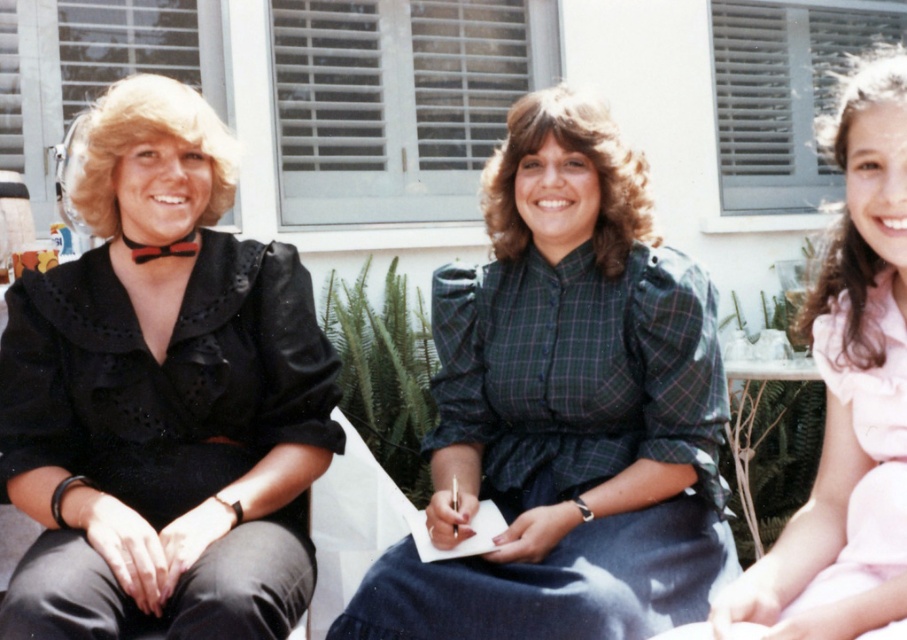
Question: Which object is the farthest from the black satin blouse at left?

Choices:
 (A) green plaid dress at center
 (B) pink satin dress at right

Answer: (B)

Question: Among these points, which one is farthest from the camera?

Choices:
 (A) (831, 291)
 (B) (498, 497)
 (C) (108, 618)

Answer: (B)

Question: Does green plaid dress at center have a larger size compared to pink satin dress at right?

Choices:
 (A) yes
 (B) no

Answer: (A)

Question: Is black satin blouse at left above pink satin dress at right?

Choices:
 (A) no
 (B) yes

Answer: (B)

Question: Is black satin blouse at left positioned in front of green plaid dress at center?

Choices:
 (A) no
 (B) yes

Answer: (B)

Question: Which point appears closest to the camera in this image?

Choices:
 (A) (233, 342)
 (B) (459, 358)
 (C) (881, 106)

Answer: (C)